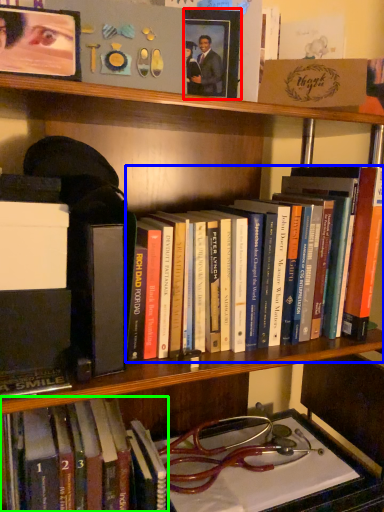
Question: Estimate the real-world distances between objects in this image. Which object is farther from picture frame (highlighted by a red box), book (highlighted by a blue box) or book (highlighted by a green box)?

Choices:
 (A) book
 (B) book

Answer: (B)